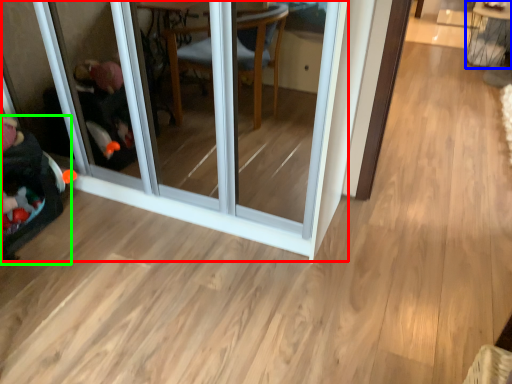
Question: Based on their relative distances, which object is farther from screen door (highlighted by a red box)? Choose from table (highlighted by a blue box) and baby carriage (highlighted by a green box).

Choices:
 (A) table
 (B) baby carriage

Answer: (A)